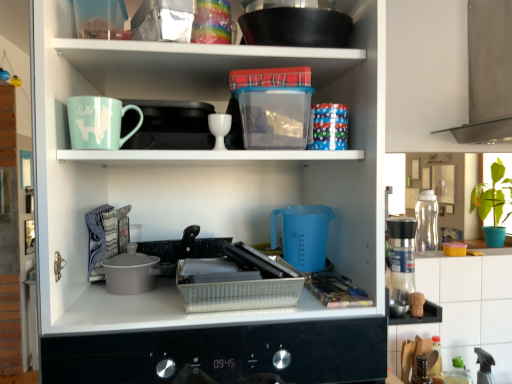
Question: From the image's perspective, does white glossy egg cup at upper center appear lower than transparent plastic water bottle at right, which is counted as the 1th appliance, starting from the right?

Choices:
 (A) yes
 (B) no

Answer: (B)

Question: From a real-world perspective, is white glossy egg cup at upper center positioned under transparent plastic water bottle at right, placed as the 2th appliance when sorted from left to right, based on gravity?

Choices:
 (A) no
 (B) yes

Answer: (A)

Question: Is the depth of white glossy egg cup at upper center less than that of transparent plastic water bottle at right, placed as the 2th appliance when sorted from left to right?

Choices:
 (A) no
 (B) yes

Answer: (B)

Question: Is white glossy egg cup at upper center further to the viewer compared to transparent plastic water bottle at right, which is counted as the 1th appliance, starting from the right?

Choices:
 (A) yes
 (B) no

Answer: (B)

Question: Is transparent plastic water bottle at right, which is counted as the 1th appliance, starting from the right, inside white glossy egg cup at upper center?

Choices:
 (A) yes
 (B) no

Answer: (B)

Question: Is white glossy egg cup at upper center to the right of transparent plastic water bottle at right, placed as the 2th appliance when sorted from left to right, from the viewer's perspective?

Choices:
 (A) yes
 (B) no

Answer: (B)

Question: Does white glossy egg cup at upper center have a greater height compared to matte ceramic mug at upper left?

Choices:
 (A) no
 (B) yes

Answer: (A)

Question: Does white glossy egg cup at upper center appear on the right side of matte ceramic mug at upper left?

Choices:
 (A) yes
 (B) no

Answer: (A)

Question: Is white glossy egg cup at upper center turned away from matte ceramic mug at upper left?

Choices:
 (A) yes
 (B) no

Answer: (B)

Question: Is white glossy egg cup at upper center not inside matte ceramic mug at upper left?

Choices:
 (A) no
 (B) yes

Answer: (B)

Question: Can you confirm if white glossy egg cup at upper center is positioned to the left of matte ceramic mug at upper left?

Choices:
 (A) yes
 (B) no

Answer: (B)

Question: Is white glossy egg cup at upper center positioned behind matte ceramic mug at upper left?

Choices:
 (A) yes
 (B) no

Answer: (A)

Question: Is white tile at upper right outside of transparent plastic water bottle at right, which is counted as the 1th appliance, starting from the back?

Choices:
 (A) no
 (B) yes

Answer: (B)